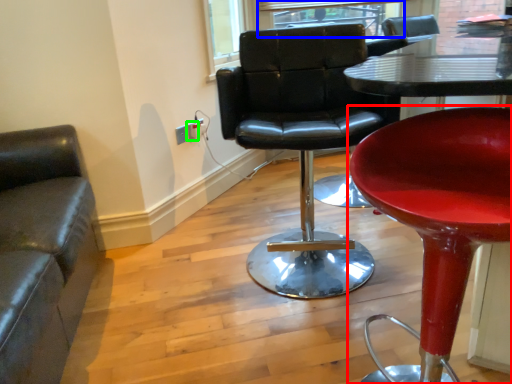
Question: Estimate the real-world distances between objects in this image. Which object is closer to chair (highlighted by a red box), window (highlighted by a blue box) or electric outlet (highlighted by a green box)?

Choices:
 (A) window
 (B) electric outlet

Answer: (B)